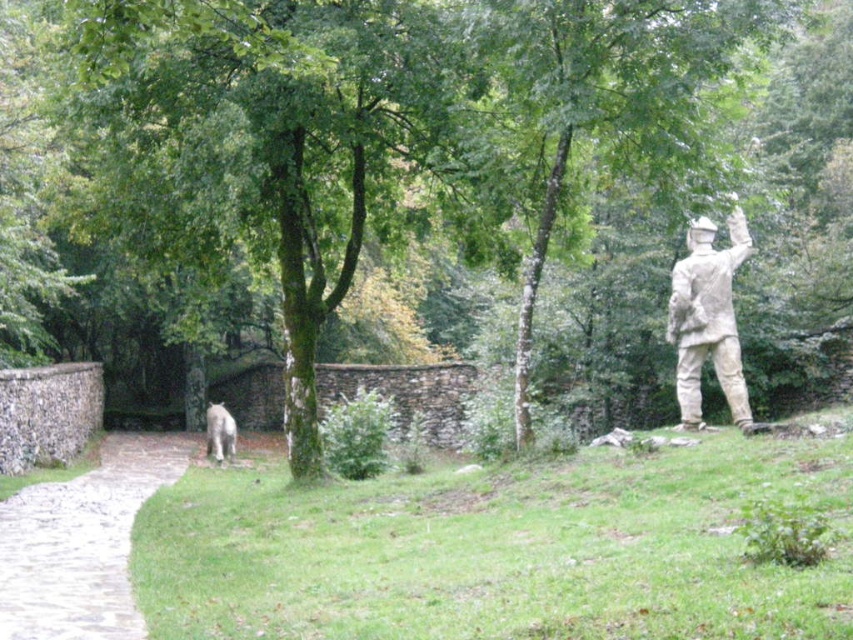
Question: Which of the following is the closest to the observer?

Choices:
 (A) cobblestone path at lower left
 (B) green grassy at lower center

Answer: (B)

Question: Which point is farther to the camera?

Choices:
 (A) green grassy at lower center
 (B) cobblestone path at lower left
 (C) white fur dog at lower left
 (D) stone statue at right

Answer: (C)

Question: From the image, what is the correct spatial relationship of green grassy at lower center in relation to stone statue at right?

Choices:
 (A) left
 (B) right

Answer: (A)

Question: Which point is closer to the camera taking this photo?

Choices:
 (A) (206, 426)
 (B) (192, 624)
 (C) (167, 445)

Answer: (B)

Question: Does cobblestone path at lower left have a greater width compared to stone statue at right?

Choices:
 (A) no
 (B) yes

Answer: (B)

Question: Is green grassy at lower center above stone statue at right?

Choices:
 (A) yes
 (B) no

Answer: (B)